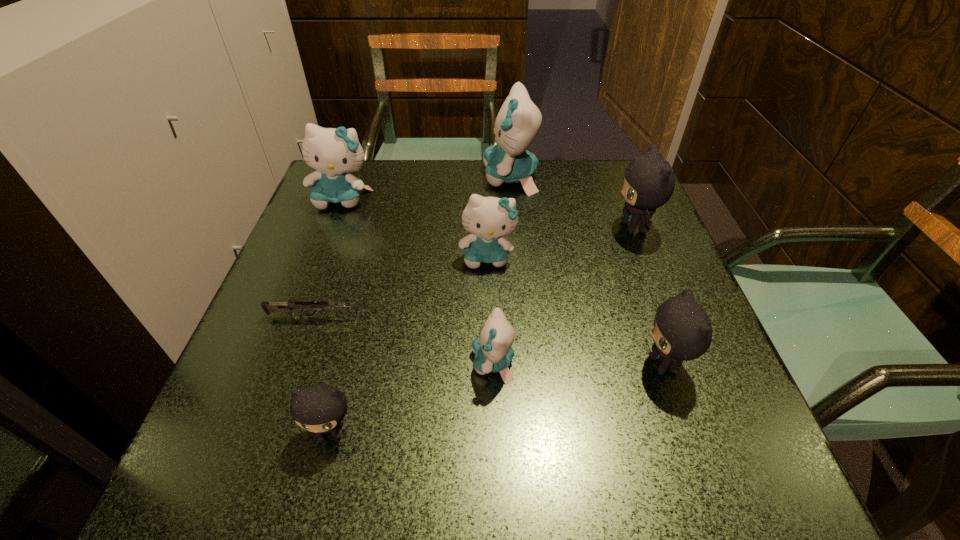
Where is `the fourth nearest object`? This screenshot has height=540, width=960. the fourth nearest object is located at coordinates (287, 308).

Find the location of a particular element. vacant position located on the face of the biggest blue kitten is located at coordinates (396, 178).

Find the location of a particular element. vacant space situated 0.270m on the face of the biggest blue kitten is located at coordinates (381, 178).

Find the location of `vacant area situated 0.110m on the face of the biggest blue kitten`. vacant area situated 0.110m on the face of the biggest blue kitten is located at coordinates (442, 178).

Find the location of a particular element. The image size is (960, 540). vacant region located on the face of the leftmost blue kitten is located at coordinates pyautogui.click(x=304, y=301).

Identify the location of vacant position located 0.080m on the front-facing side of the biggest gray kitten. The width and height of the screenshot is (960, 540). (577, 227).

The width and height of the screenshot is (960, 540). I want to click on free space located on the front-facing side of the biggest gray kitten, so click(473, 227).

This screenshot has height=540, width=960. Find the location of `free region located 0.330m on the front-facing side of the biggest gray kitten`. free region located 0.330m on the front-facing side of the biggest gray kitten is located at coordinates coord(469,227).

This screenshot has height=540, width=960. Identify the location of vacant area located on the face of the second nearest blue kitten. (489, 302).

Identify the location of free spot located 0.110m on the front-facing side of the second nearest gray kitten. This screenshot has width=960, height=540. (576, 364).